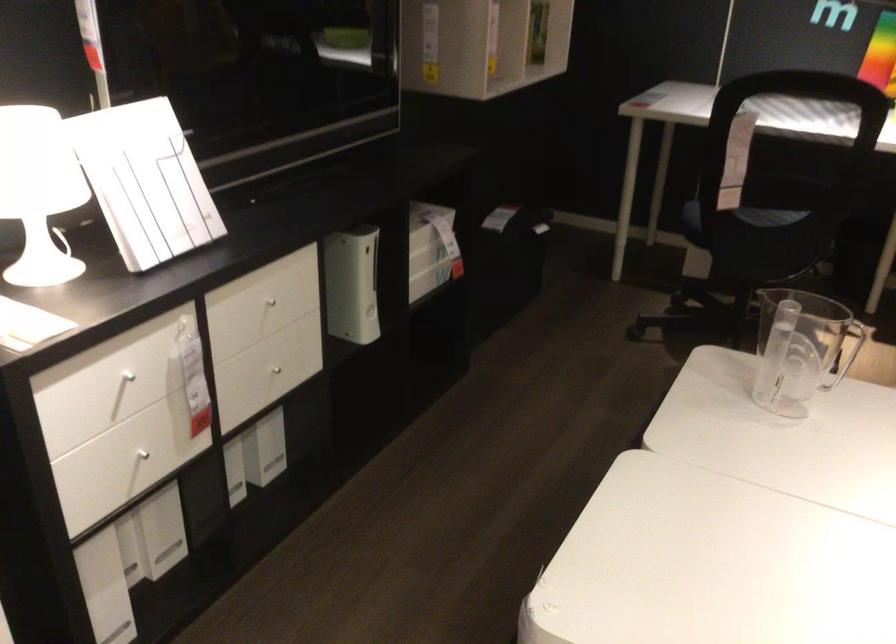
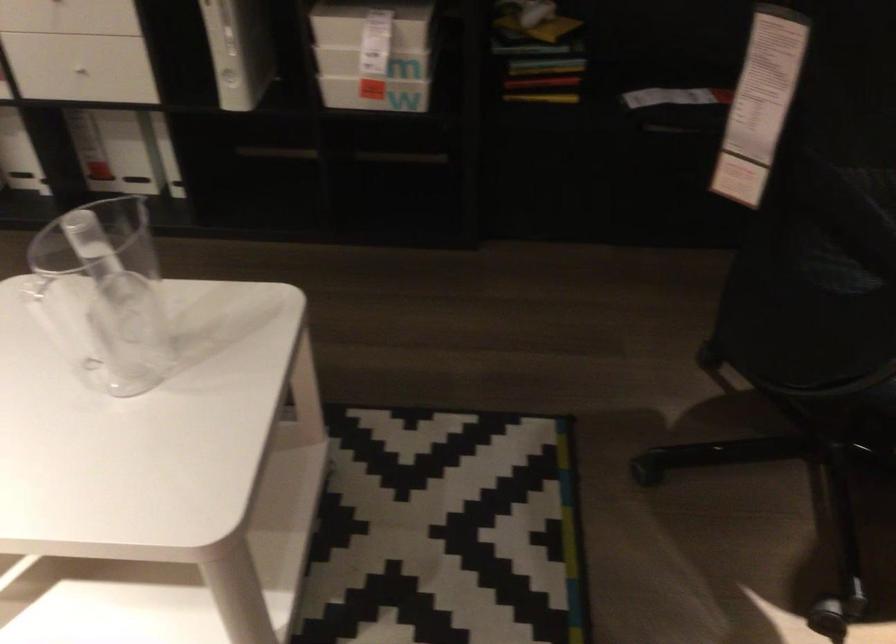
Find the pixel in the second image that matches point 814,243 in the first image.

(837, 364)